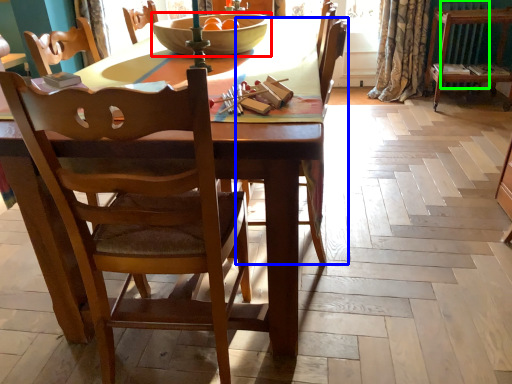
Question: Which object is the closest to the bowl (highlighted by a red box)? Choose among these: chair (highlighted by a blue box) or radiator (highlighted by a green box).

Choices:
 (A) chair
 (B) radiator

Answer: (A)